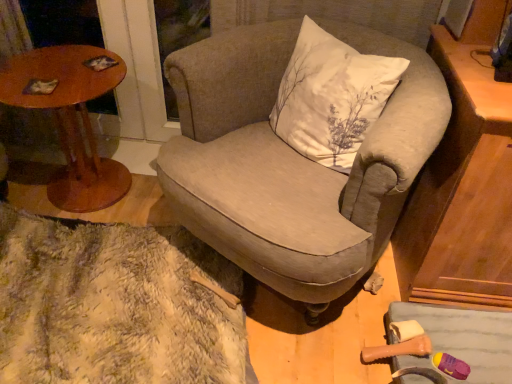
Question: From the image's perspective, would you say white cotton pillow at center is shown under wooden round table at left?

Choices:
 (A) no
 (B) yes

Answer: (A)

Question: Is white cotton pillow at center wider than wooden round table at left?

Choices:
 (A) no
 (B) yes

Answer: (A)

Question: From a real-world perspective, does white cotton pillow at center stand above wooden round table at left?

Choices:
 (A) yes
 (B) no

Answer: (A)

Question: From the image's perspective, is white cotton pillow at center over wooden round table at left?

Choices:
 (A) no
 (B) yes

Answer: (B)

Question: Is wooden round table at left at the back of white cotton pillow at center?

Choices:
 (A) no
 (B) yes

Answer: (A)

Question: Considering their positions, is white cotton pillow at center located in front of or behind textured beige armchair at center?

Choices:
 (A) behind
 (B) front

Answer: (A)

Question: Is white cotton pillow at center inside the boundaries of textured beige armchair at center, or outside?

Choices:
 (A) inside
 (B) outside

Answer: (A)

Question: From the image's perspective, is white cotton pillow at center positioned above or below textured beige armchair at center?

Choices:
 (A) below
 (B) above

Answer: (B)

Question: From their relative heights in the image, would you say white cotton pillow at center is taller or shorter than textured beige armchair at center?

Choices:
 (A) short
 (B) tall

Answer: (A)

Question: In the image, is textured beige armchair at center positioned in front of or behind matte brown cabinet at right?

Choices:
 (A) front
 (B) behind

Answer: (A)

Question: From a real-world perspective, is textured beige armchair at center physically located above or below matte brown cabinet at right?

Choices:
 (A) above
 (B) below

Answer: (B)

Question: In terms of size, does textured beige armchair at center appear bigger or smaller than matte brown cabinet at right?

Choices:
 (A) small
 (B) big

Answer: (B)

Question: Is point (399, 104) closer or farther from the camera than point (474, 269)?

Choices:
 (A) closer
 (B) farther

Answer: (A)

Question: Would you say wooden round table at left is to the left or to the right of textured beige armchair at center in the picture?

Choices:
 (A) right
 (B) left

Answer: (B)

Question: From a real-world perspective, is wooden round table at left above or below textured beige armchair at center?

Choices:
 (A) below
 (B) above

Answer: (A)